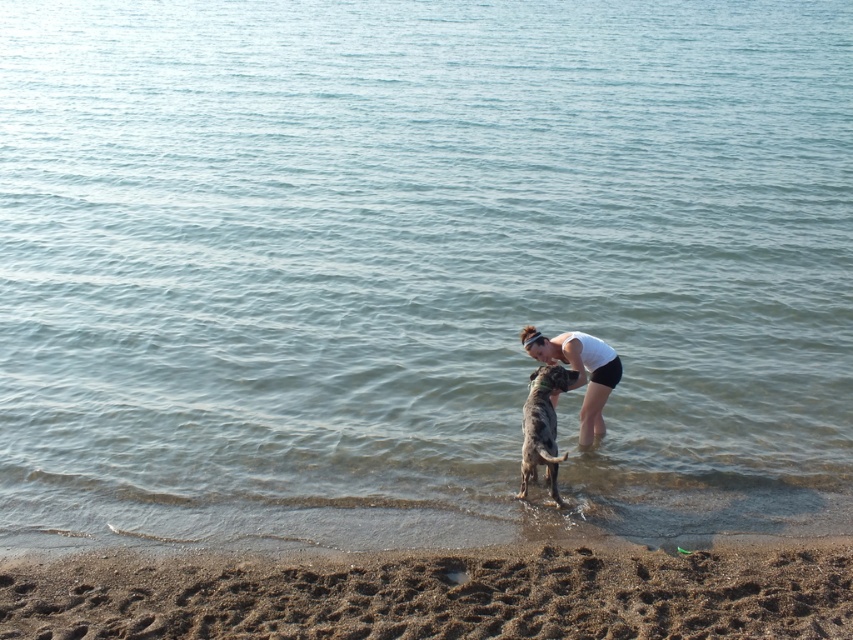
You are a photographer trying to capture the scene of the woman and her dog on the beach. You need to ensure that the brown sandy mud at lower center and the white matte shirt at center are both visible in the frame. Based on their widths, which object should you prioritize framing wider to include its entirety?

The brown sandy mud at lower center should be prioritized for wider framing since its width surpasses that of the white matte shirt at center, meaning it requires more space to be fully captured.

Consider the image. You are a photographer capturing this beach scene. You want to ensure the speckled fur dog at center and the white matte shirt at center are both in focus. Which object should you position your camera focus closer to?

You should focus closer to the speckled fur dog at center because the white matte shirt at center is to the right of the speckled fur dog at center, meaning the dog is closer to the camera.

You are a photographer trying to capture the perfect shot of the woman and her dog at the beach. You want to ensure the white matte shirt at center is clearly visible in the frame. Based on its position, where should you aim your camera?

The white matte shirt at center is located at point (579, 371), so you should aim your camera towards those coordinates to ensure it is clearly visible in the frame.